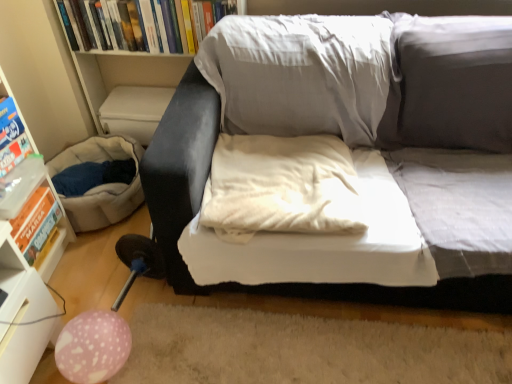
Image resolution: width=512 pixels, height=384 pixels. Describe the element at coordinates (349, 144) in the screenshot. I see `matte gray couch at center` at that location.

This screenshot has height=384, width=512. What are the coordinates of `white soft pillow at center` in the screenshot? It's located at (281, 187).

This screenshot has width=512, height=384. What are the coordinates of `orange cardboard book at left, the third paperback book from the top` in the screenshot? It's located at (36, 223).

Where is `hardcover book at upper center`? The width and height of the screenshot is (512, 384). hardcover book at upper center is located at coordinates (140, 23).

From the picture: Does hardcover book at upper center have a lesser height compared to orange cardboard book at left, marked as the first paperback book in a bottom-to-top arrangement?

Incorrect, the height of hardcover book at upper center does not fall short of that of orange cardboard book at left, marked as the first paperback book in a bottom-to-top arrangement.

From the image's perspective, is hardcover book at upper center located beneath orange cardboard book at left, marked as the first paperback book in a bottom-to-top arrangement?

Actually, hardcover book at upper center appears above orange cardboard book at left, marked as the first paperback book in a bottom-to-top arrangement, in the image.

Is hardcover book at upper center positioned with its back to orange cardboard book at left, the third paperback book from the top?

No, hardcover book at upper center is not facing away from orange cardboard book at left, the third paperback book from the top.

Can you tell me how much hardcover book at upper center and orange cardboard book at left, marked as the first paperback book in a bottom-to-top arrangement, differ in facing direction?

88.8 degrees.

Between matte gray couch at center and white plastic shelf at left, which one has more height?

white plastic shelf at left is taller.

Are matte gray couch at center and white plastic shelf at left far apart?

They are positioned close to each other.

Does point (229, 277) appear closer or farther from the camera than point (11, 171)?

Point (229, 277).

From a real-world perspective, which object stands above the other?

From a 3D spatial view, matte gray couch at center is above.

Is beige fabric bean bag at lower left bigger than matte blue paperback book at left, which ranks as the second paperback book in top-to-bottom order?

Correct, beige fabric bean bag at lower left is larger in size than matte blue paperback book at left, which ranks as the second paperback book in top-to-bottom order.

Does beige fabric bean bag at lower left touch matte blue paperback book at left, the second paperback book ordered from the bottom?

No, beige fabric bean bag at lower left is not making contact with matte blue paperback book at left, the second paperback book ordered from the bottom.

Can you confirm if beige fabric bean bag at lower left is shorter than matte blue paperback book at left, the second paperback book ordered from the bottom?

No.

Identify the location of bean bag chair on the right of matte blue paperback book at left, which ranks as the second paperback book in top-to-bottom order. (101, 184).

Is orange cardboard book at left, the third paperback book from the top, bigger than beige fabric bean bag at lower left?

No.

Does point (41, 207) come closer to viewer compared to point (100, 139)?

Yes, it is in front of point (100, 139).

Can you tell me how much orange cardboard book at left, the third paperback book from the top, and beige fabric bean bag at lower left differ in facing direction?

The angle between the facing direction of orange cardboard book at left, the third paperback book from the top, and the facing direction of beige fabric bean bag at lower left is 0.198 degrees.

In terms of width, does orange cardboard book at left, the third paperback book from the top, look wider or thinner when compared to beige fabric bean bag at lower left?

orange cardboard book at left, the third paperback book from the top, is thinner than beige fabric bean bag at lower left.

From their relative heights in the image, would you say white plastic shelf at left is taller or shorter than hardcover book at upper center?

In the image, white plastic shelf at left appears to be taller than hardcover book at upper center.

In the scene shown: Who is more distant, white plastic shelf at left or hardcover book at upper center?

hardcover book at upper center is behind.

Image resolution: width=512 pixels, height=384 pixels. Identify the location of shelf on the left of hardcover book at upper center. (26, 250).

Between white plastic shelf at left and hardcover book at upper center, which one has smaller width?

hardcover book at upper center.

Are white soft pillow at center and matte gray couch at center located far from each other?

No, white soft pillow at center is not far away from matte gray couch at center.

Which of these two, white soft pillow at center or matte gray couch at center, stands taller?

With more height is matte gray couch at center.

Could you tell me if white soft pillow at center is facing matte gray couch at center?

Yes, white soft pillow at center is oriented towards matte gray couch at center.

What's the angular difference between white soft pillow at center and matte gray couch at center's facing directions?

The facing directions of white soft pillow at center and matte gray couch at center are 0.314 degrees apart.

Considering the sizes of objects white plastic shelf at left and matte blue paperback book at left, the second paperback book ordered from the bottom, in the image provided, who is smaller, white plastic shelf at left or matte blue paperback book at left, the second paperback book ordered from the bottom,?

matte blue paperback book at left, the second paperback book ordered from the bottom.

Is white plastic shelf at left in contact with matte blue paperback book at left, the second paperback book ordered from the bottom?

white plastic shelf at left and matte blue paperback book at left, the second paperback book ordered from the bottom, are clearly separated.

Is white plastic shelf at left not within matte blue paperback book at left, the second paperback book ordered from the bottom?

Yes, white plastic shelf at left is located beyond the bounds of matte blue paperback book at left, the second paperback book ordered from the bottom.

From the hardcover book at upper center, count 1st paperback books forward and point to it. Please provide its 2D coordinates.

[(36, 223)]

There is a white plastic shelf at left. Where is `studio couch above it (from a real-world perspective)`? Image resolution: width=512 pixels, height=384 pixels. studio couch above it (from a real-world perspective) is located at coordinates (349, 144).

Based on their spatial positions, is hardcover book at upper center or matte gray couch at center closer to pink dotted balloon at lower left?

matte gray couch at center lies closer to pink dotted balloon at lower left than the other object.

Looking at the image, which one is located closer to matte gray couch at center, orange cardboard book at left, the third paperback book from the top, or white soft pillow at center?

The object closer to matte gray couch at center is white soft pillow at center.

Based on their spatial positions, is matte blue paperback book at left, which ranks as the second paperback book in top-to-bottom order, or white plastic shelf at left further from pink dotted balloon at lower left?

matte blue paperback book at left, which ranks as the second paperback book in top-to-bottom order, lies further to pink dotted balloon at lower left than the other object.

Looking at the image, which one is located further to pink dotted balloon at lower left, white soft pillow at center or orange cardboard book at left, the third paperback book from the top?

white soft pillow at center.

Estimate the real-world distances between objects in this image. Which object is further from beige fabric bean bag at lower left, white plastic shelf at left or matte gray couch at center?

matte gray couch at center is positioned further to the anchor beige fabric bean bag at lower left.

Estimate the real-world distances between objects in this image. Which object is further from beige fabric bean bag at lower left, matte blue paperback book at left, which ranks as the second paperback book in top-to-bottom order, or white soft pillow at center?

white soft pillow at center.

When comparing their distances from pink dotted balloon at lower left, does white soft pillow at center or matte gray couch at center seem closer?

The object closer to pink dotted balloon at lower left is white soft pillow at center.

Based on their spatial positions, is pink dotted balloon at lower left or beige fabric bean bag at lower left further from matte blue paperback book at left, the second paperback book ordered from the bottom?

Among the two, pink dotted balloon at lower left is located further to matte blue paperback book at left, the second paperback book ordered from the bottom.

Find the location of `toy between blue matte book at left, the third paperback book ordered from the bottom, and white soft pillow at center`. toy between blue matte book at left, the third paperback book ordered from the bottom, and white soft pillow at center is located at coordinates (93, 347).

In order to click on paperback book located between blue matte book at left, the 1th paperback book from the top, and matte gray couch at center in the left-right direction in this screenshot , I will do `click(36, 223)`.

Where is `paperback book between beige fabric bean bag at lower left and pink dotted balloon at lower left in the vertical direction`? The width and height of the screenshot is (512, 384). paperback book between beige fabric bean bag at lower left and pink dotted balloon at lower left in the vertical direction is located at coordinates (36, 223).

Locate an element on the screen. pillow between hardcover book at upper center and pink dotted balloon at lower left in the up-down direction is located at coordinates (281, 187).